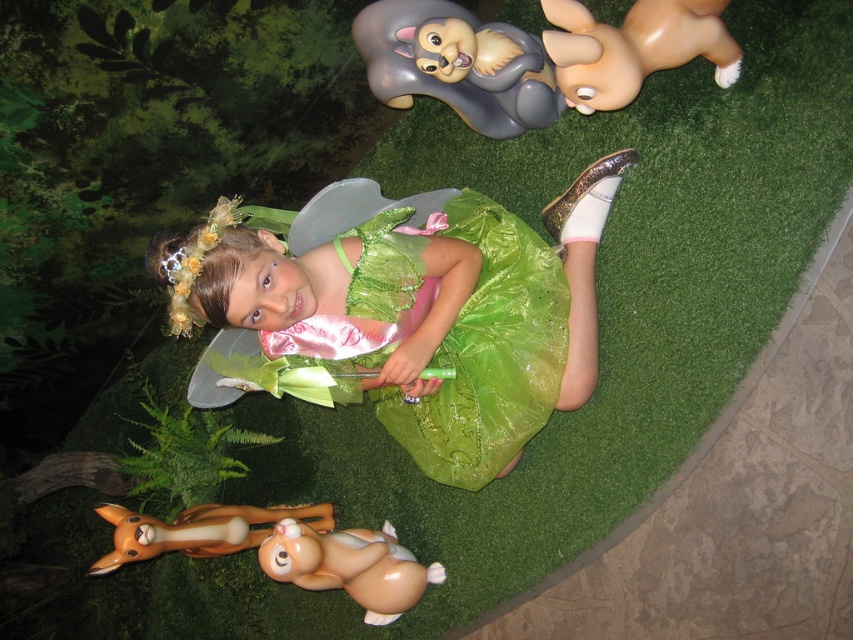
Question: Does gray matte squirrel at upper center appear under smooth beige plush toy at lower center?

Choices:
 (A) no
 (B) yes

Answer: (A)

Question: Among these points, which one is nearest to the camera?

Choices:
 (A) (357, 598)
 (B) (456, 12)
 (C) (196, 532)

Answer: (B)

Question: Among these points, which one is nearest to the camera?

Choices:
 (A) (386, 102)
 (B) (618, 86)
 (C) (397, 545)
 (D) (498, 374)

Answer: (B)

Question: Which object is closer to the camera taking this photo?

Choices:
 (A) green tulle dress at center
 (B) brown matte/soft toy at lower left
 (C) gray matte squirrel at upper center
 (D) brown matte rabbit at upper center

Answer: (A)

Question: Is gray matte squirrel at upper center to the left of brown matte rabbit at upper center from the viewer's perspective?

Choices:
 (A) no
 (B) yes

Answer: (B)

Question: Does brown matte rabbit at upper center have a smaller size compared to smooth beige plush toy at lower center?

Choices:
 (A) yes
 (B) no

Answer: (A)